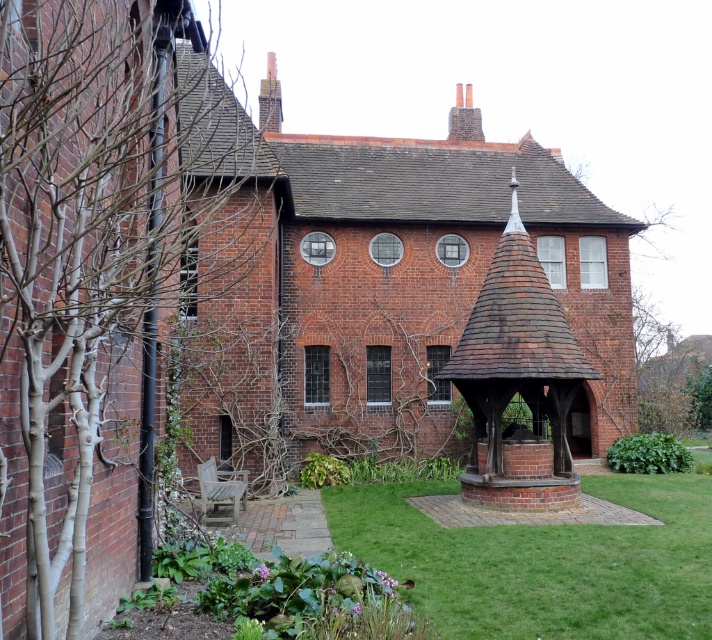
Consider the image. You are standing at the entrance of the brick building and want to walk towards the green grass at center. Which direction should you walk?

The green grass at center is located at point (543,561) in the image, so you should walk towards the center of the image to reach it.

You are standing in the garden area and want to place a new flower bed between the green grass at center and the brown wooden gazebo at center. Based on their positions, where should the flower bed be placed relative to the gazebo?

The green grass at center is positioned on the left side of brown wooden gazebo at center, so the flower bed should be placed to the left of the brown wooden gazebo at center.

You are standing in front of the brick building and want to locate two specific points marked on the ground. The first point is at coordinates point (x=460, y=595) and the second is at point (x=471, y=472). Which of these points is closer to you?

Point (x=460, y=595) is closer to the viewer than point (x=471, y=472).